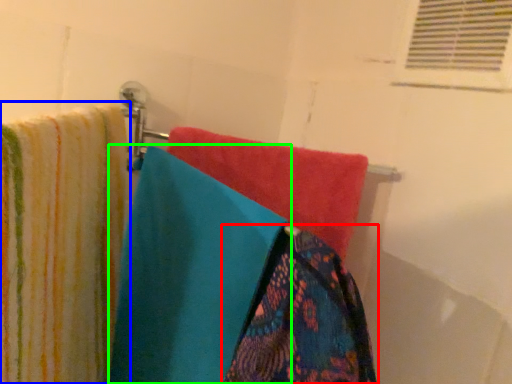
Question: Which object is the closest to the towel (highlighted by a red box)? Choose among these: towel (highlighted by a blue box) or towel (highlighted by a green box).

Choices:
 (A) towel
 (B) towel

Answer: (B)